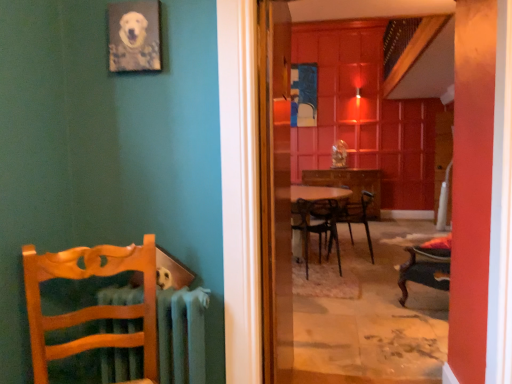
Question: Is metallic radiator at left next to wooden chair at center, the 2th chair in the back-to-front sequence?

Choices:
 (A) yes
 (B) no

Answer: (B)

Question: Are metallic radiator at left and wooden chair at center, the 2th chair from the front, far apart?

Choices:
 (A) no
 (B) yes

Answer: (B)

Question: From a real-world perspective, is metallic radiator at left under wooden chair at center, the 2th chair from the front?

Choices:
 (A) no
 (B) yes

Answer: (A)

Question: From a real-world perspective, is metallic radiator at left located higher than wooden chair at center, arranged as the 2th chair when viewed from the right?

Choices:
 (A) yes
 (B) no

Answer: (A)

Question: Is metallic radiator at left wider than wooden chair at center, the 2th chair positioned from the left?

Choices:
 (A) no
 (B) yes

Answer: (A)

Question: Is metallic radiator at left spatially inside wooden table at center, or outside of it?

Choices:
 (A) inside
 (B) outside

Answer: (B)

Question: Would you say metallic radiator at left is to the left or to the right of wooden table at center in the picture?

Choices:
 (A) right
 (B) left

Answer: (B)

Question: In the image, is metallic radiator at left positioned in front of or behind wooden table at center?

Choices:
 (A) front
 (B) behind

Answer: (A)

Question: In terms of height, does metallic radiator at left look taller or shorter compared to wooden table at center?

Choices:
 (A) tall
 (B) short

Answer: (B)

Question: From a real-world perspective, relative to wooden picture frame at upper left, is transparent glass screen door at center, which ranks as the first screen door in front-to-back order, vertically above or below?

Choices:
 (A) below
 (B) above

Answer: (A)

Question: Considering the positions of transparent glass screen door at center, placed as the 2th screen door when sorted from back to front, and wooden picture frame at upper left in the image, is transparent glass screen door at center, placed as the 2th screen door when sorted from back to front, wider or thinner than wooden picture frame at upper left?

Choices:
 (A) thin
 (B) wide

Answer: (B)

Question: From the image's perspective, is transparent glass screen door at center, which ranks as the first screen door in front-to-back order, located above or below wooden picture frame at upper left?

Choices:
 (A) below
 (B) above

Answer: (A)

Question: Relative to wooden picture frame at upper left, is transparent glass screen door at center, placed as the 2th screen door when sorted from back to front, in front or behind?

Choices:
 (A) front
 (B) behind

Answer: (A)

Question: Is transparent glass screen door at center, which ranks as the first screen door in front-to-back order, wider or thinner than metallic black chair at center, which appears as the third chair when viewed from the front?

Choices:
 (A) wide
 (B) thin

Answer: (B)

Question: Considering the positions of transparent glass screen door at center, placed as the 2th screen door when sorted from back to front, and metallic black chair at center, positioned as the first chair in right-to-left order, in the image, is transparent glass screen door at center, placed as the 2th screen door when sorted from back to front, bigger or smaller than metallic black chair at center, positioned as the first chair in right-to-left order,?

Choices:
 (A) small
 (B) big

Answer: (A)